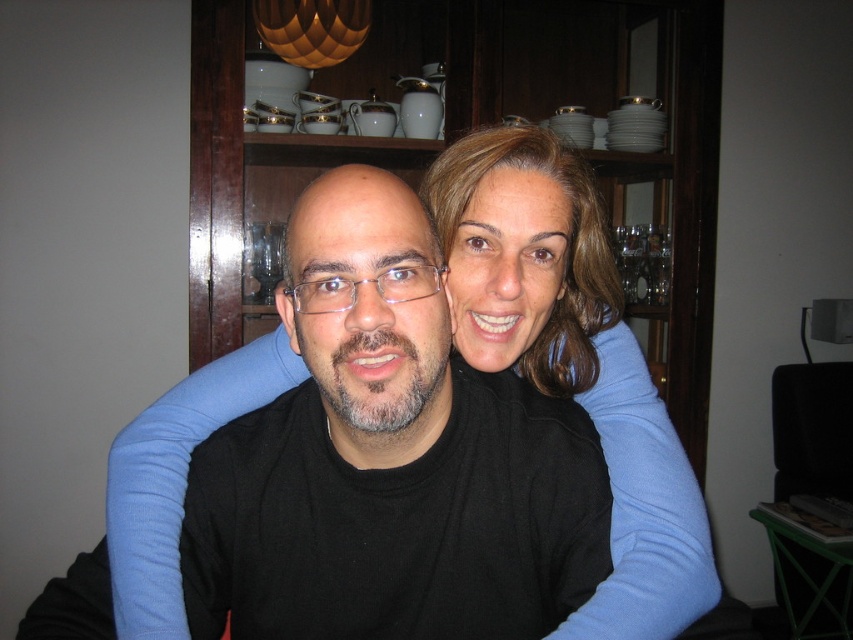
Is point (614, 452) farther from viewer compared to point (561, 324)?

That is False.

Is black matte shirt at center wider than smooth brown hair at center?

Yes.

I want to click on black matte shirt at center, so click(x=575, y=364).